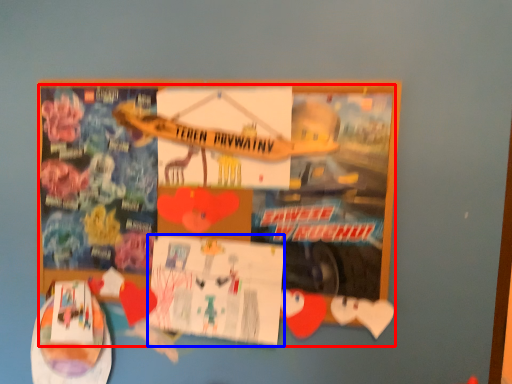
Question: Which object is closer to the camera taking this photo, poster (highlighted by a red box) or flyer (highlighted by a blue box)?

Choices:
 (A) poster
 (B) flyer

Answer: (A)